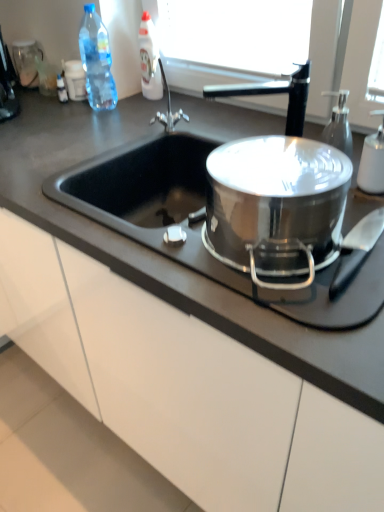
This screenshot has height=512, width=384. Identify the location of empty space that is to the right of white glossy bottle at upper center, the 3th bottle in the bottom-to-top sequence. (189, 100).